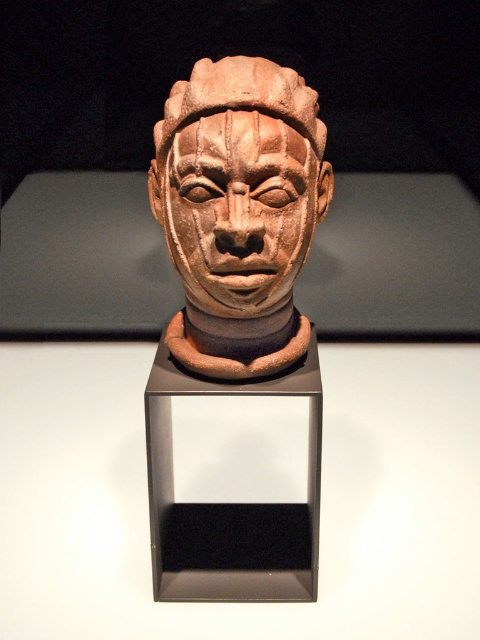
Question: Which of the following is the farthest from the observer?

Choices:
 (A) (196, 129)
 (B) (278, 257)

Answer: (B)

Question: Which point appears farthest from the camera in this image?

Choices:
 (A) (x=156, y=195)
 (B) (x=295, y=234)

Answer: (A)

Question: Is terracotta statue at center to the left of matte clay head at center from the viewer's perspective?

Choices:
 (A) yes
 (B) no

Answer: (A)

Question: Which object appears farthest from the camera in this image?

Choices:
 (A) terracotta statue at center
 (B) matte clay head at center

Answer: (A)

Question: Does terracotta statue at center have a lesser width compared to matte clay head at center?

Choices:
 (A) yes
 (B) no

Answer: (B)

Question: Does terracotta statue at center appear on the right side of matte clay head at center?

Choices:
 (A) no
 (B) yes

Answer: (A)